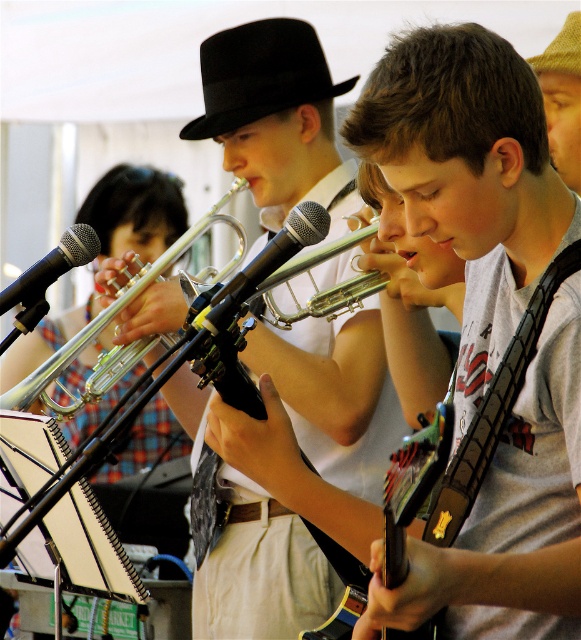
From the picture: Can you confirm if silver shiny trumpet at center is bigger than silver metallic microphone at center?

Yes.

Measure the distance between silver shiny trumpet at center and camera.

silver shiny trumpet at center and camera are 3.09 meters apart.

What are the coordinates of `silver shiny trumpet at center` in the screenshot? It's located at (112, 320).

Between matte black guitar at center and black metallic microphone at left, which one is positioned higher?

black metallic microphone at left is higher up.

How far apart are matte black guitar at center and black metallic microphone at left?

matte black guitar at center and black metallic microphone at left are 30.94 inches apart.

Image resolution: width=581 pixels, height=640 pixels. In order to click on matte black guitar at center in this screenshot , I will do `click(468, 176)`.

Is silver/metallic trumpet at center in front of black metallic microphone at left?

That is True.

I want to click on silver/metallic trumpet at center, so click(315, 284).

Describe the element at coordinates (315, 284) in the screenshot. This screenshot has width=581, height=640. I see `silver/metallic trumpet at center` at that location.

The height and width of the screenshot is (640, 581). Find the location of `silver/metallic trumpet at center`. silver/metallic trumpet at center is located at coordinates (315, 284).